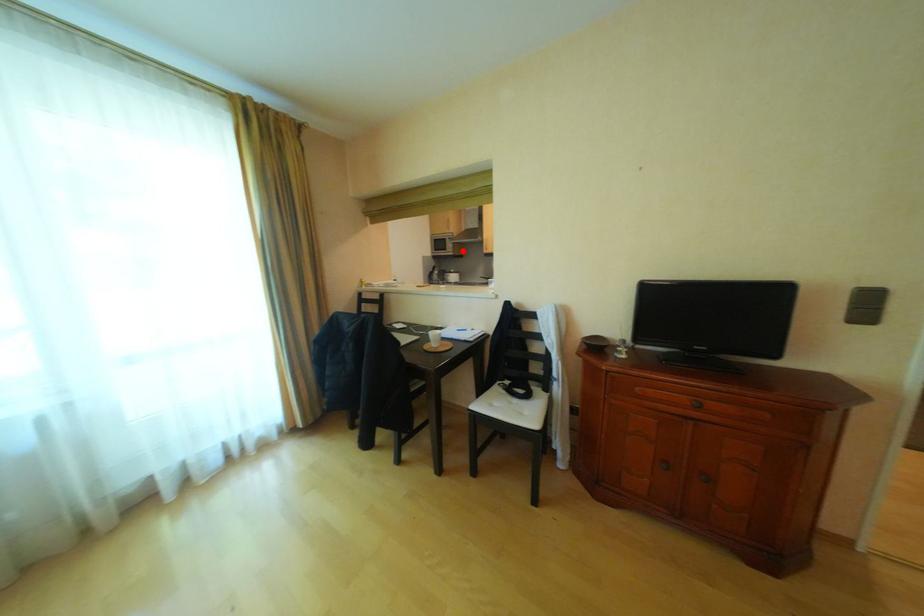
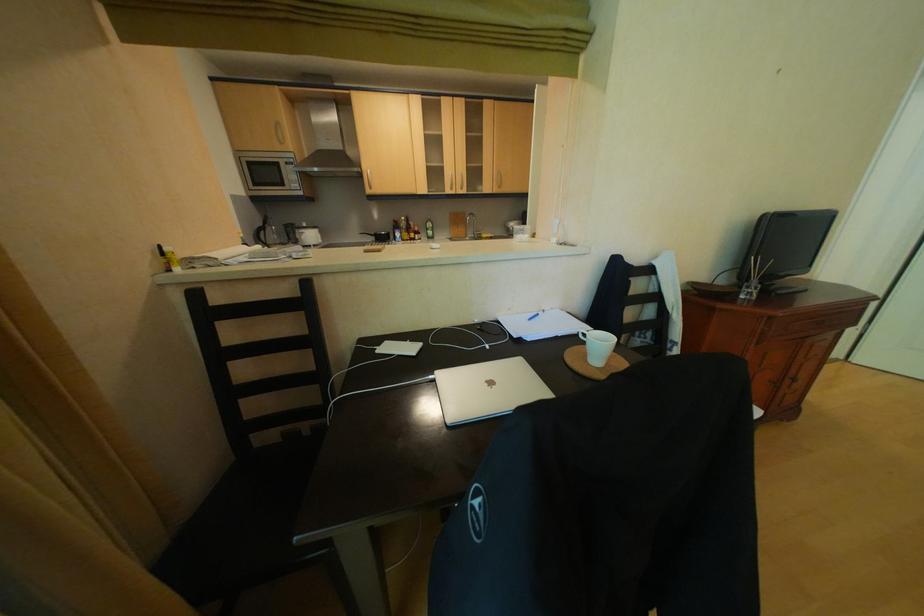
The point at the highlighted location is marked in the first image. Where is the corresponding point in the second image?

(310, 187)